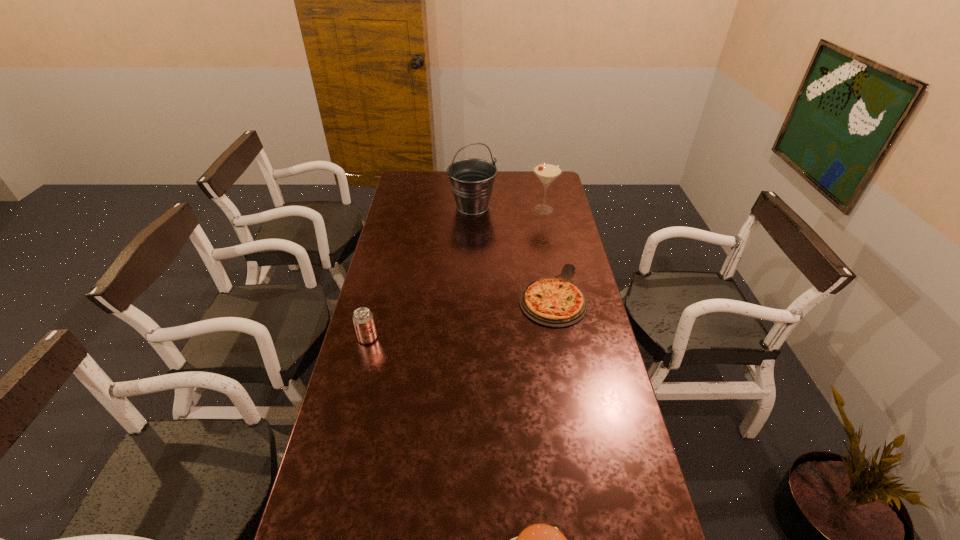
The image size is (960, 540). What are the coordinates of `free space between the martini and the fourth farthest object` in the screenshot? It's located at (456, 274).

What are the coordinates of `free spot between the bucket and the martini` in the screenshot? It's located at (508, 208).

Find the location of a particular element. The width and height of the screenshot is (960, 540). empty space that is in between the pizza and the second tallest object is located at coordinates (547, 252).

You are a GUI agent. You are given a task and a screenshot of the screen. Output one action in this format:
    pyautogui.click(x=<x>, y=<y>)
    Task: Click on the object that is the third closest one to the beer can
    This screenshot has width=960, height=540.
    Given the screenshot: What is the action you would take?
    pyautogui.click(x=472, y=180)

Where is `object that can be found as the closest to the beer can`? The width and height of the screenshot is (960, 540). object that can be found as the closest to the beer can is located at coordinates (556, 302).

The width and height of the screenshot is (960, 540). What are the coordinates of `vacant region that satisfies the following two spatial constraints: 1. on the back side of the shortest object; 2. on the right side of the third tallest object` in the screenshot? It's located at (379, 294).

Identify the location of free space in the image that satisfies the following two spatial constraints: 1. on the back side of the martini; 2. on the left side of the third farthest object. The width and height of the screenshot is (960, 540). (537, 210).

Find the location of a particular element. The width and height of the screenshot is (960, 540). free space that satisfies the following two spatial constraints: 1. on the back side of the pizza; 2. on the left side of the fourth shortest object is located at coordinates (537, 210).